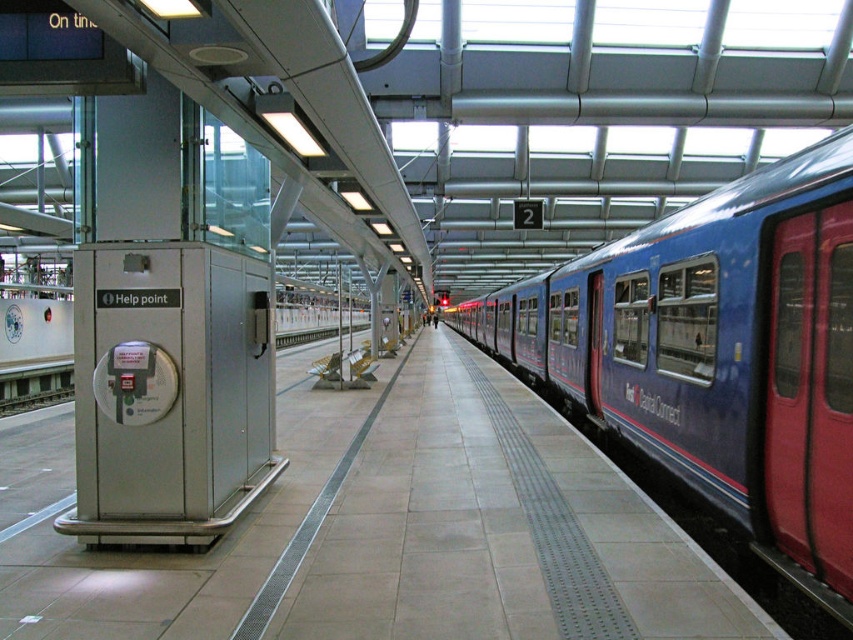
Which is more to the left, smooth concrete platform at center or blue metallic train at center?

smooth concrete platform at center

Which is in front, point (447, 452) or point (737, 243)?

Point (737, 243) is in front.

Measure the distance between point (251, 554) and camera.

They are 18.77 feet apart.

Find the location of a particular element. This screenshot has width=853, height=640. smooth concrete platform at center is located at coordinates (386, 531).